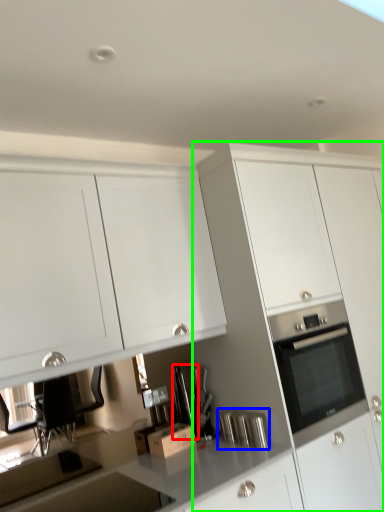
Question: Based on their relative distances, which object is nearer to appliance (highlighted by a red box)? Choose from appliance (highlighted by a blue box) and cabinetry (highlighted by a green box).

Choices:
 (A) appliance
 (B) cabinetry

Answer: (A)